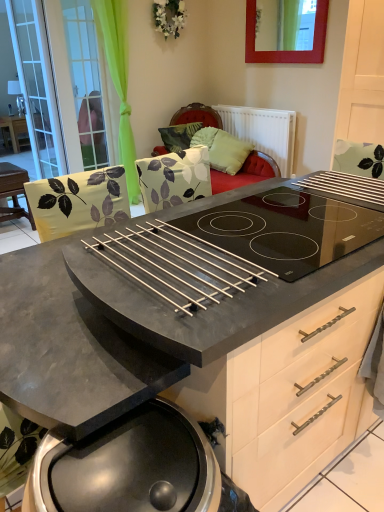
At what (x,y) coordinates should I click in order to perform the action: click on blank space situated above white matte radiator at upper center (from a real-world perspective). Please return your answer as a coordinate pair (x, y). Looking at the image, I should click on (258, 104).